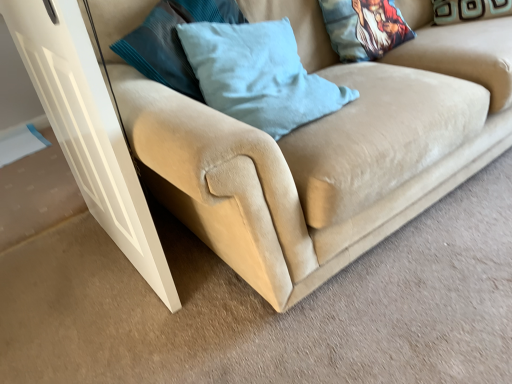
Question: Considering the relative sizes of teal velvet pillow at upper right, marked as the first pillow in a right-to-left arrangement, and light blue fabric pillow at center, the third pillow when ordered from right to left, in the image provided, is teal velvet pillow at upper right, marked as the first pillow in a right-to-left arrangement, shorter than light blue fabric pillow at center, the third pillow when ordered from right to left,?

Choices:
 (A) no
 (B) yes

Answer: (B)

Question: Is teal velvet pillow at upper right, which is the third pillow from left to right, to the right of light blue fabric pillow at center, the third pillow when ordered from right to left, from the viewer's perspective?

Choices:
 (A) yes
 (B) no

Answer: (A)

Question: Is the depth of teal velvet pillow at upper right, which is the third pillow from left to right, less than that of light blue fabric pillow at center, the third pillow when ordered from right to left?

Choices:
 (A) no
 (B) yes

Answer: (A)

Question: From a real-world perspective, is teal velvet pillow at upper right, marked as the first pillow in a right-to-left arrangement, on light blue fabric pillow at center, the third pillow when ordered from right to left?

Choices:
 (A) yes
 (B) no

Answer: (B)

Question: Would you say light blue fabric pillow at center, the third pillow when ordered from right to left, is part of teal velvet pillow at upper right, marked as the first pillow in a right-to-left arrangement,'s contents?

Choices:
 (A) no
 (B) yes

Answer: (A)

Question: From a real-world perspective, is light blue fabric pillow at center, the third pillow when ordered from right to left, positioned above or below printed fabric pillow at upper right, the 2th pillow from the left?

Choices:
 (A) above
 (B) below

Answer: (A)

Question: Considering the positions of light blue fabric pillow at center, arranged as the first pillow when viewed from the left, and printed fabric pillow at upper right, the 2th pillow from the left, in the image, is light blue fabric pillow at center, arranged as the first pillow when viewed from the left, bigger or smaller than printed fabric pillow at upper right, the 2th pillow from the left,?

Choices:
 (A) small
 (B) big

Answer: (B)

Question: Based on their positions, is light blue fabric pillow at center, the third pillow when ordered from right to left, located to the left or right of printed fabric pillow at upper right, the 2th pillow viewed from the right?

Choices:
 (A) right
 (B) left

Answer: (B)

Question: In terms of width, does light blue fabric pillow at center, arranged as the first pillow when viewed from the left, look wider or thinner when compared to printed fabric pillow at upper right, the 2th pillow viewed from the right?

Choices:
 (A) wide
 (B) thin

Answer: (A)

Question: From the image's perspective, is printed fabric pillow at upper right, the 2th pillow from the left, located above or below beige suede couch at lower left?

Choices:
 (A) above
 (B) below

Answer: (A)

Question: In terms of height, does printed fabric pillow at upper right, the 2th pillow viewed from the right, look taller or shorter compared to beige suede couch at lower left?

Choices:
 (A) short
 (B) tall

Answer: (A)

Question: Considering the positions of printed fabric pillow at upper right, the 2th pillow from the left, and beige suede couch at lower left in the image, is printed fabric pillow at upper right, the 2th pillow from the left, wider or thinner than beige suede couch at lower left?

Choices:
 (A) wide
 (B) thin

Answer: (B)

Question: Is point (377, 56) positioned closer to the camera than point (344, 241)?

Choices:
 (A) closer
 (B) farther

Answer: (B)

Question: Would you say light blue fabric pillow at center, the third pillow when ordered from right to left, is to the left or to the right of teal velvet pillow at upper right, which is the third pillow from left to right, in the picture?

Choices:
 (A) right
 (B) left

Answer: (B)

Question: Considering the positions of light blue fabric pillow at center, arranged as the first pillow when viewed from the left, and teal velvet pillow at upper right, which is the third pillow from left to right, in the image, is light blue fabric pillow at center, arranged as the first pillow when viewed from the left, wider or thinner than teal velvet pillow at upper right, which is the third pillow from left to right,?

Choices:
 (A) thin
 (B) wide

Answer: (B)